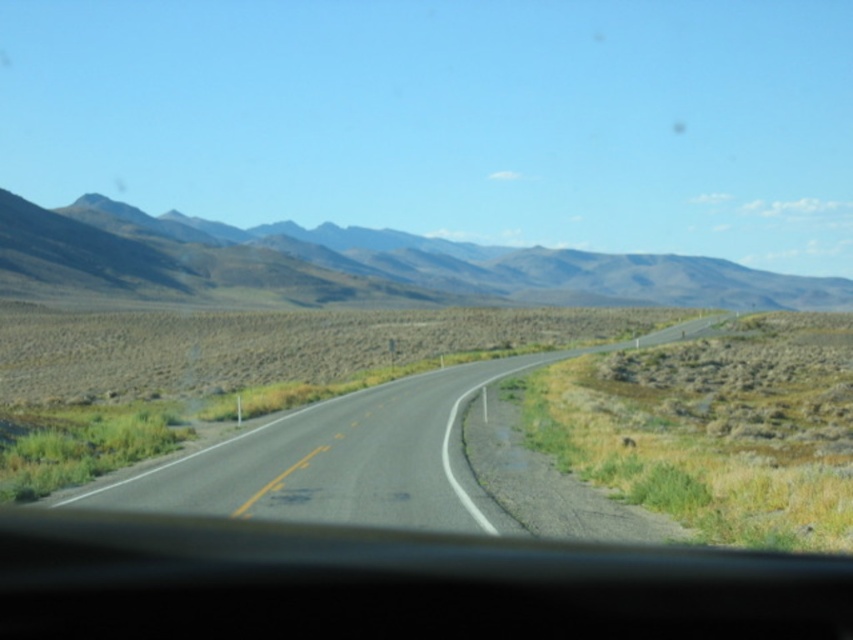
Question: Which point is farther to the camera?

Choices:
 (A) (715, 284)
 (B) (392, 515)

Answer: (A)

Question: Can you confirm if gray rocky mountain at upper center is positioned to the left of asphalt road at center?

Choices:
 (A) yes
 (B) no

Answer: (B)

Question: Which point appears farthest from the camera in this image?

Choices:
 (A) (462, 529)
 (B) (103, 272)

Answer: (B)

Question: Which point is closer to the camera?

Choices:
 (A) (352, 291)
 (B) (445, 500)

Answer: (B)

Question: Is gray rocky mountain at upper center positioned at the back of asphalt road at center?

Choices:
 (A) no
 (B) yes

Answer: (B)

Question: Is gray rocky mountain at upper center to the left of asphalt road at center from the viewer's perspective?

Choices:
 (A) yes
 (B) no

Answer: (B)